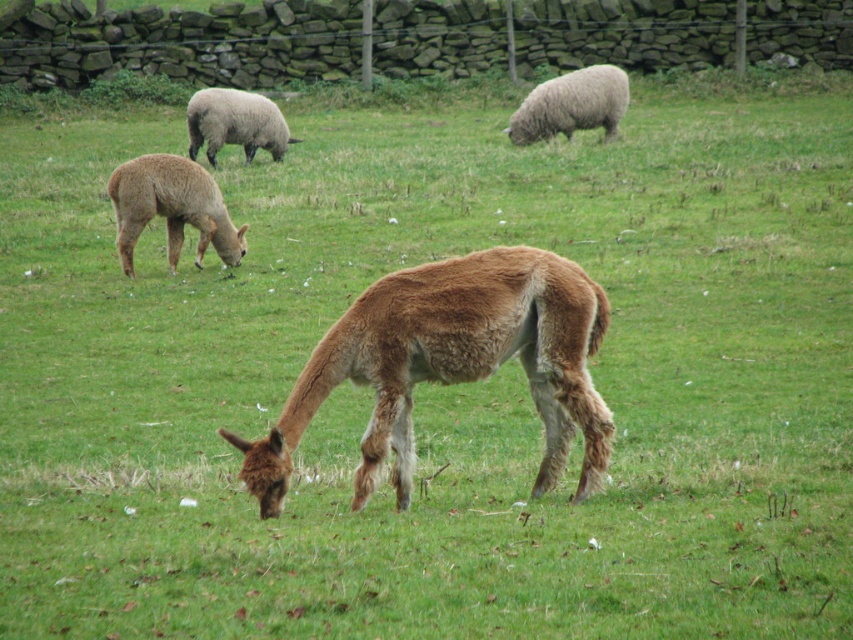
Between brown woolen sheep at left and white woolly sheep at upper right, which one has less height?

Standing shorter between the two is brown woolen sheep at left.

Is brown woolen sheep at left taller than white woolly sheep at upper right?

No.

You are a GUI agent. You are given a task and a screenshot of the screen. Output one action in this format:
    pyautogui.click(x=<x>, y=<y>)
    Task: Click on the brown woolen sheep at left
    This screenshot has height=640, width=853.
    Given the screenshot: What is the action you would take?
    pyautogui.click(x=171, y=209)

Is brown woolly alpaca at center above brown woolen sheep at left?

No, brown woolly alpaca at center is not above brown woolen sheep at left.

Who is more forward, (517, 340) or (177, 237)?

Positioned in front is point (517, 340).

Does point (281, 490) lie in front of point (148, 172)?

Yes, point (281, 490) is closer to viewer.

Locate an element on the screen. The height and width of the screenshot is (640, 853). brown woolly alpaca at center is located at coordinates (451, 364).

Based on the photo, can you confirm if brown woolly alpaca at center is thinner than white woolly sheep at upper right?

Yes.

Does brown woolly alpaca at center appear on the right side of white woolly sheep at upper right?

Incorrect, brown woolly alpaca at center is not on the right side of white woolly sheep at upper right.

Is point (544, 288) behind point (570, 104)?

No, it is in front of (570, 104).

This screenshot has height=640, width=853. I want to click on brown woolly alpaca at center, so click(x=451, y=364).